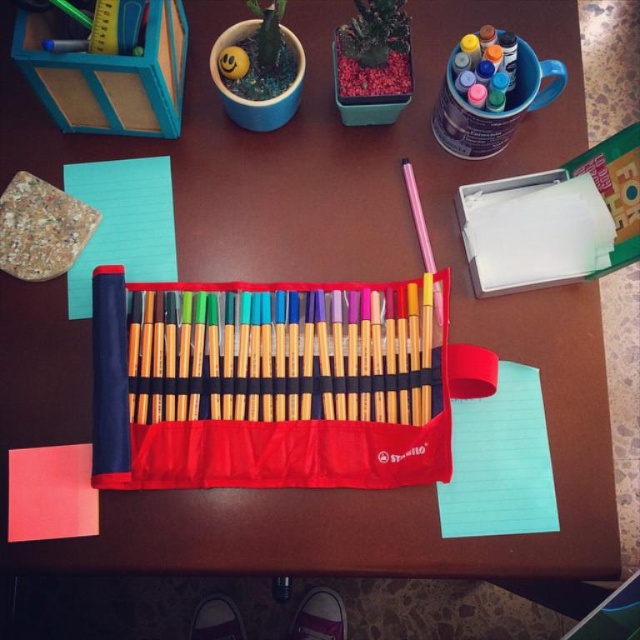
You are an artist who needs to choose between the light blue paper at center and the red matte notepad at lower left for a project. Which one has a larger width?

The light blue paper at center has a larger width than the red matte notepad at lower left.

You are an artist who wants to reach the light blue paper at center to sketch an idea. If your hand can extend 30 inches, can you comfortably reach it without moving your chair?

The light blue paper at center is 29.51 inches away from the viewer, so yes, the artist can comfortably reach it with their hand since it is within the 30 inches extension range.

You are an artist who needs to place a 15 cm tall sculpture between the matte fabric pencil case at center and the light blue paper at lower right. Can the sculpture fit vertically between them?

The matte fabric pencil case at center is much taller than the light blue paper at lower right. Since the sculpture is 15 cm tall, it can fit vertically between them as long as the vertical space between the pencil case and the paper allows for it. However, the exact vertical clearance isn